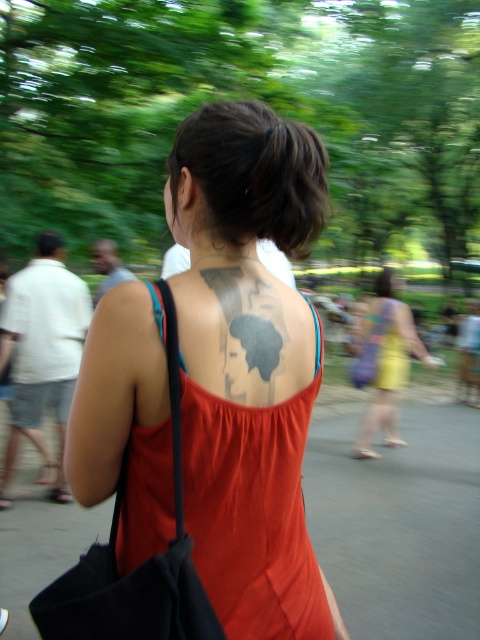
You are a photographer trying to capture a closeup of the matte black tattoo at upper center and the yellow fabric dress at center. Given their sizes, which one will require you to zoom in more to focus on its details?

The matte black tattoo at upper center occupies less space than the yellow fabric dress at center, so you will need to zoom in more on the matte black tattoo at upper center to focus on its details.

You are a photographer adjusting your camera settings. You want to ensure the dark gray tattoo at center back is in focus. Given that the camera focuses on the center point, will the tattoo be in focus?

The dark gray tattoo at center back is located at point (x=249, y=364), which is close to the center of the image. Since the camera focuses on the center point, the tattoo will likely be in focus.

You are a photographer trying to capture the matte black tattoo at upper center and the yellow fabric dress at center in the same frame. Based on their sizes in the image, which one will appear larger in your photo?

The matte black tattoo at upper center is much taller than the yellow fabric dress at center, so it will appear larger in the photo.